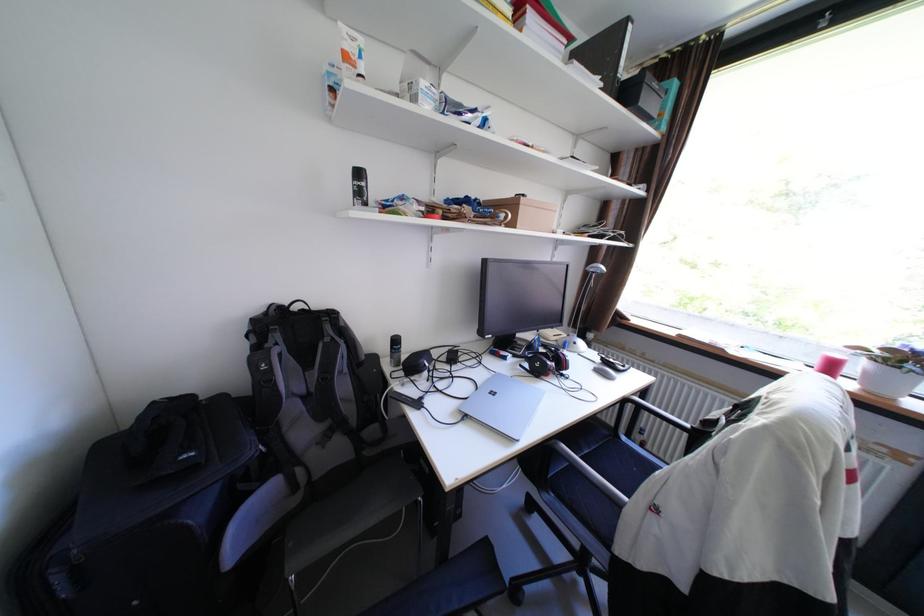
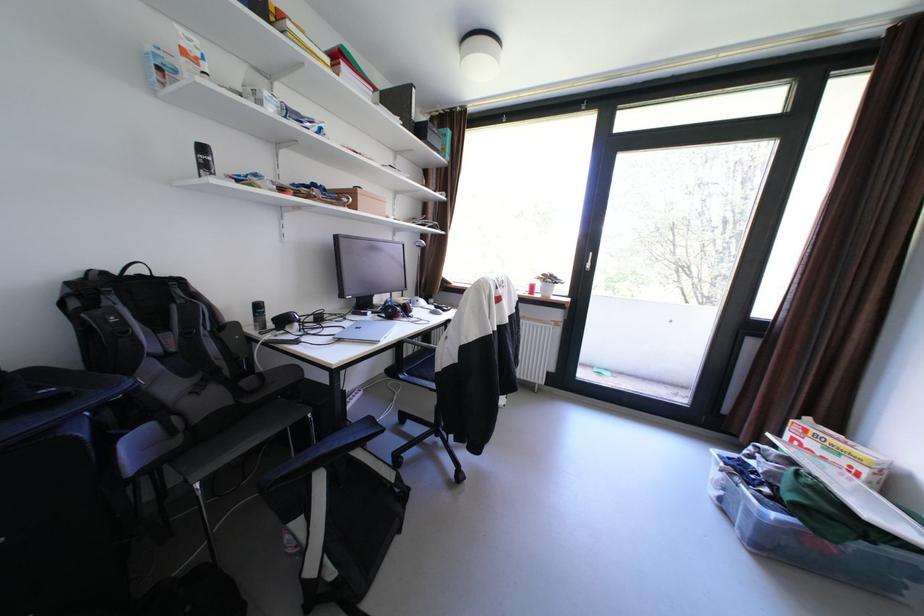
In the second image, find the point that corresponds to point 313,310 in the first image.

(151, 276)